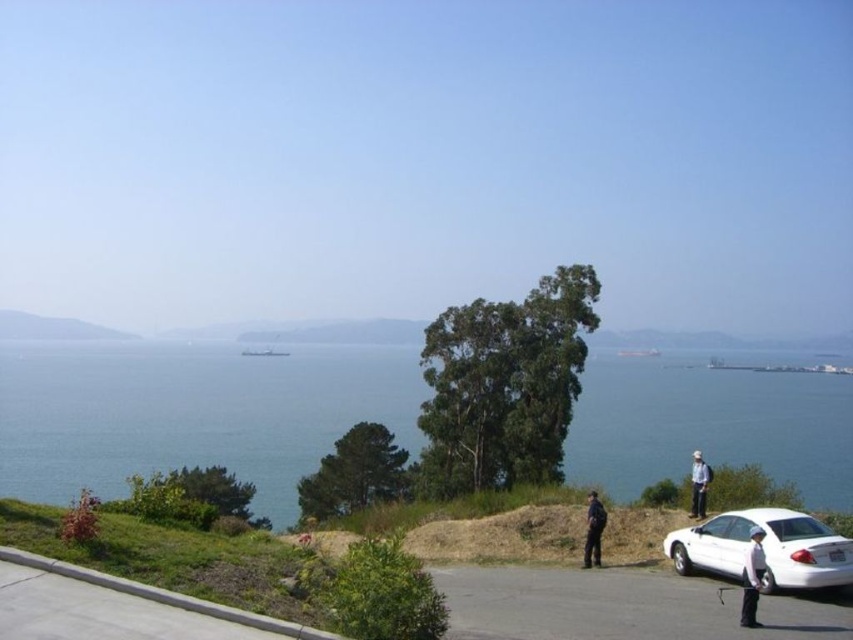
Question: Among these objects, which one is nearest to the camera?

Choices:
 (A) white matte shirt at lower right
 (B) black uniform at center

Answer: (A)

Question: Does white glossy sedan at lower right come behind black uniform at center?

Choices:
 (A) no
 (B) yes

Answer: (A)

Question: Is blue water at center positioned before white glossy sedan at lower right?

Choices:
 (A) yes
 (B) no

Answer: (B)

Question: Which of the following is the farthest from the observer?

Choices:
 (A) white glossy sedan at lower right
 (B) black uniform at center
 (C) blue water at center

Answer: (C)

Question: Estimate the real-world distances between objects in this image. Which object is closer to the white fabric shirt at lower right?

Choices:
 (A) white glossy sedan at lower right
 (B) blue water at center

Answer: (A)

Question: Observing the image, what is the correct spatial positioning of black uniform at center in reference to white fabric shirt at lower right?

Choices:
 (A) below
 (B) above

Answer: (B)